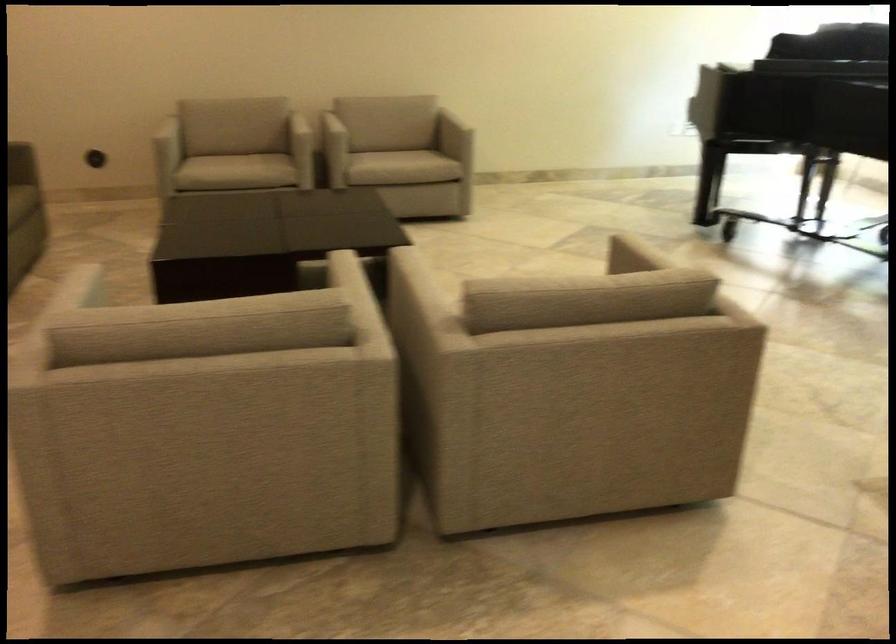
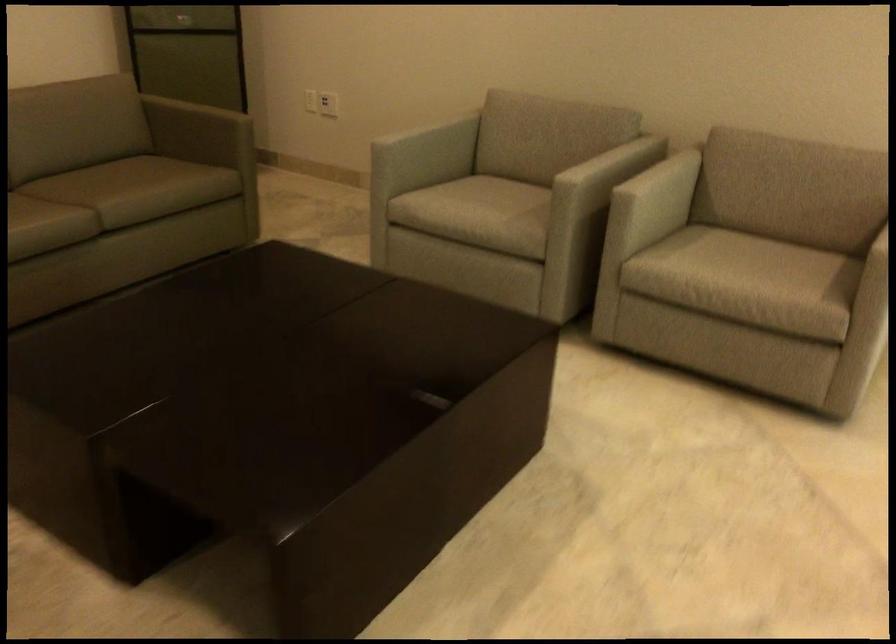
Where in the second image is the point corresponding to [332,126] from the first image?

(661, 187)